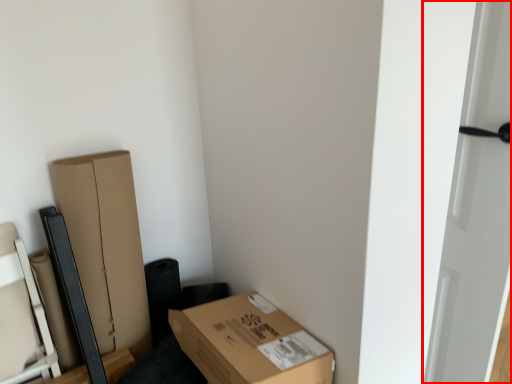
Question: From the image's perspective, where is door (annotated by the red box) located relative to box?

Choices:
 (A) above
 (B) below

Answer: (A)